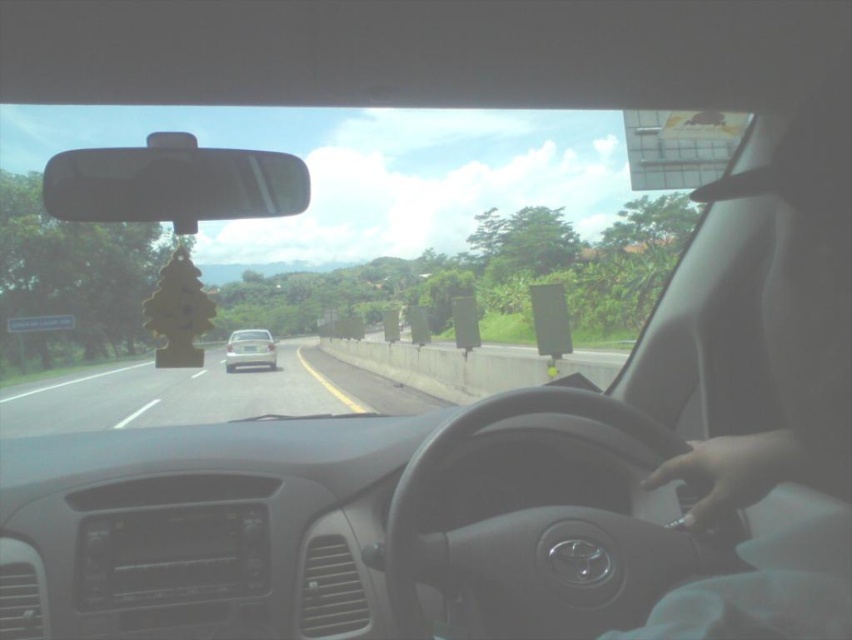
You are driving a car and want to check the road ahead. Which object, the transparent glass windshield at center or the matte silver sedan at center, would allow you to see the road more clearly?

The transparent glass windshield at center allows clearer visibility of the road ahead compared to the matte silver sedan at center because it is made of transparent glass, while the sedan is an opaque object positioned below the windshield.

You are driving a car and want to check the road ahead. Which object, the transparent glass windshield at center or the white glossy car at center, is closer to you?

The transparent glass windshield at center is closer to the viewer than the white glossy car at center.